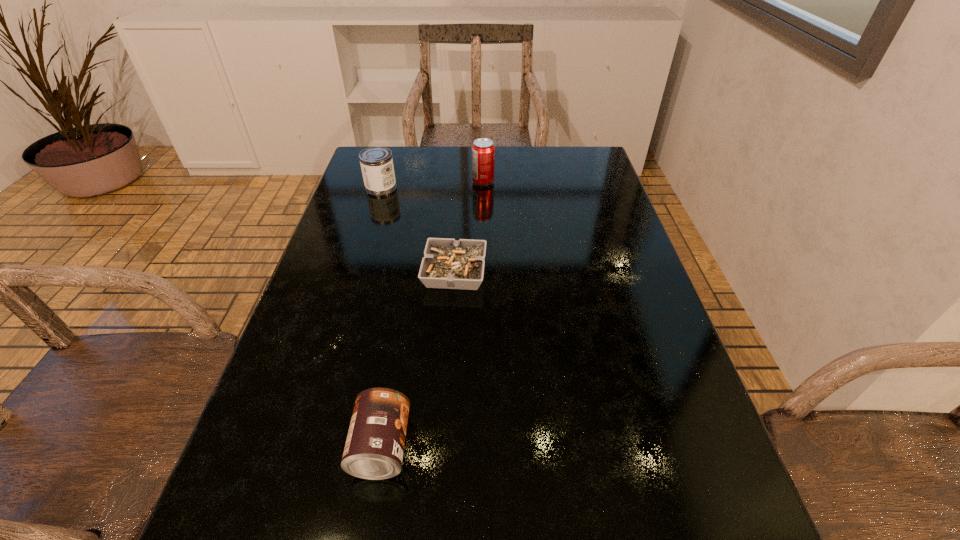
Find the location of `object that stands as the third closest to the soda`. object that stands as the third closest to the soda is located at coordinates (374, 448).

You are a GUI agent. You are given a task and a screenshot of the screen. Output one action in this format:
    pyautogui.click(x=<x>, y=<y>)
    Task: Click on the closest object to the shortest object
    Image resolution: width=960 pixels, height=540 pixels.
    Given the screenshot: What is the action you would take?
    pyautogui.click(x=376, y=163)